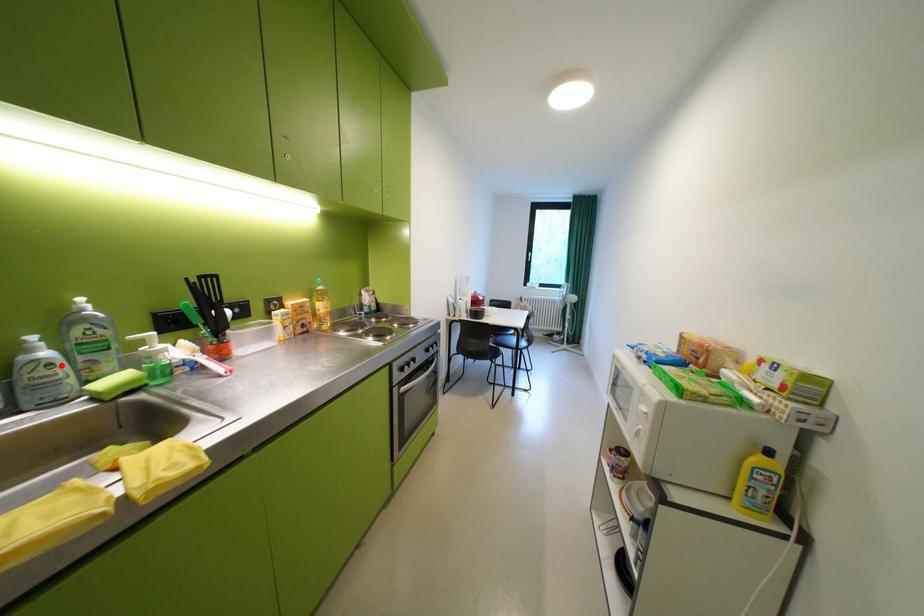
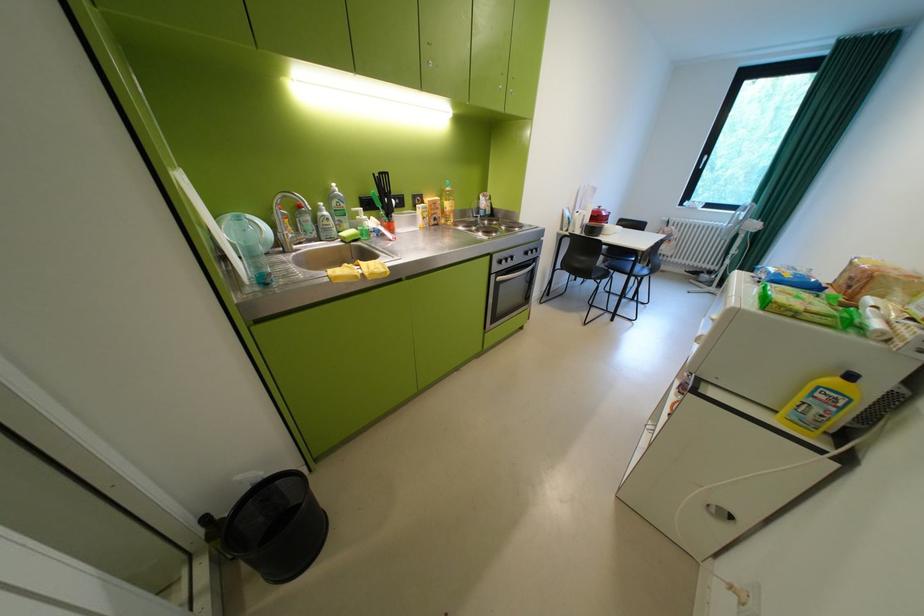
Find the pixel in the second image that matches the highlighted location in the first image.

(338, 220)